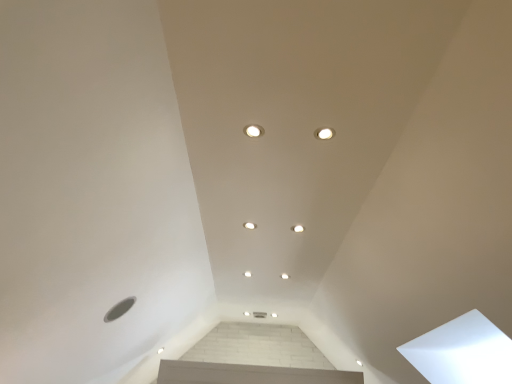
Question: Should I look upward or downward to see white glossy light fixture at center, placed as the 5th dot when sorted from back to front?

Choices:
 (A) down
 (B) up

Answer: (A)

Question: Which direction should I rotate to face white glossy light fixture at center, the 5th dot in the right-to-left sequence, — up or down?

Choices:
 (A) up
 (B) down

Answer: (B)

Question: Does white glossy light fixture at upper center, which is the 6th dot from bottom to top, have a greater width compared to white glossy light fixture at center, which appears as the second dot when viewed from the back?

Choices:
 (A) yes
 (B) no

Answer: (A)

Question: Is white glossy light fixture at upper center, the 1th dot viewed from the front, directly adjacent to white glossy light fixture at center, the fifth dot in the front-to-back sequence?

Choices:
 (A) yes
 (B) no

Answer: (B)

Question: Does white glossy light fixture at upper center, which ranks as the 1th dot in right-to-left order, turn towards white glossy light fixture at center, which is the fifth dot from top to bottom?

Choices:
 (A) yes
 (B) no

Answer: (A)

Question: Are white glossy light fixture at upper center, which appears as the 6th dot when viewed from the back, and white glossy light fixture at center, which is the second dot in bottom-to-top order, located far from each other?

Choices:
 (A) no
 (B) yes

Answer: (B)

Question: Does white glossy light fixture at upper center, arranged as the 1th dot when viewed from the top, appear on the left side of white glossy light fixture at center, which is counted as the fourth dot, starting from the left?

Choices:
 (A) no
 (B) yes

Answer: (A)

Question: From the image's perspective, does white glossy light fixture at upper center, arranged as the sixth dot when viewed from the left, appear higher than white glossy light fixture at center, the fifth dot in the front-to-back sequence?

Choices:
 (A) yes
 (B) no

Answer: (A)

Question: Is the depth of white glossy dot at center, the sixth dot viewed from the right, greater than that of white glossy light fixture at upper center, which ranks as the 3th dot in left-to-right order?

Choices:
 (A) no
 (B) yes

Answer: (A)

Question: Is white glossy dot at center, marked as the third dot in a bottom-to-top arrangement, located outside white glossy light fixture at upper center, which ranks as the 3th dot in left-to-right order?

Choices:
 (A) yes
 (B) no

Answer: (A)

Question: Is white glossy light fixture at upper center, which ranks as the 3th dot in left-to-right order, surrounded by white glossy dot at center, which appears as the first dot when viewed from the left?

Choices:
 (A) no
 (B) yes

Answer: (A)

Question: Does white glossy dot at center, the sixth dot viewed from the right, touch white glossy light fixture at upper center, acting as the sixth dot starting from the top?

Choices:
 (A) yes
 (B) no

Answer: (B)

Question: From a real-world perspective, is white glossy dot at center, which ranks as the 4th dot in front-to-back order, over white glossy light fixture at upper center, positioned as the sixth dot in front-to-back order?

Choices:
 (A) no
 (B) yes

Answer: (B)

Question: From the image's perspective, is white glossy dot at center, which ranks as the 4th dot in front-to-back order, located beneath white glossy light fixture at upper center, marked as the first dot in a back-to-front arrangement?

Choices:
 (A) yes
 (B) no

Answer: (B)

Question: Does white glossy dot at center, positioned as the 3th dot in back-to-front order, have a greater width compared to white glossy light fixture at center, which is counted as the fourth dot, starting from the left?

Choices:
 (A) no
 (B) yes

Answer: (B)